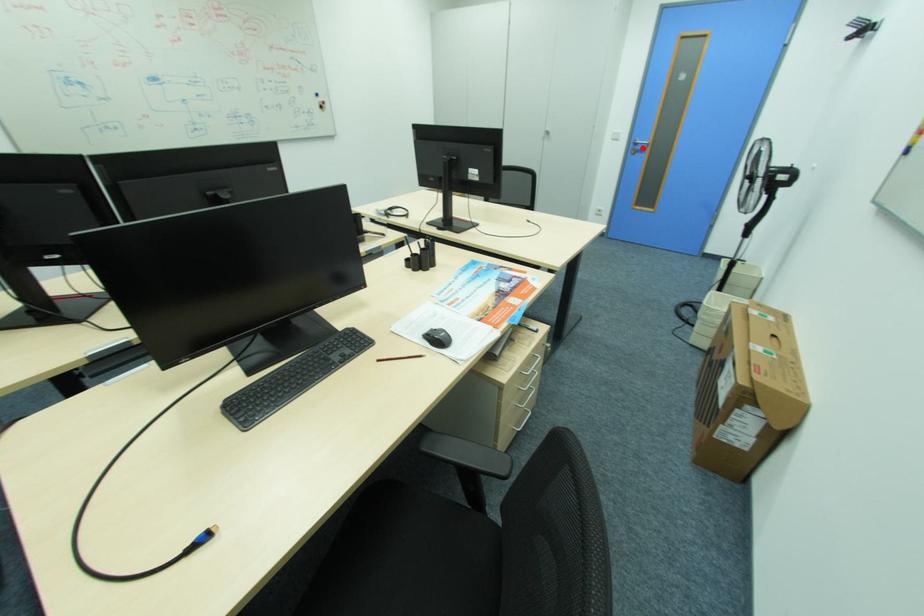
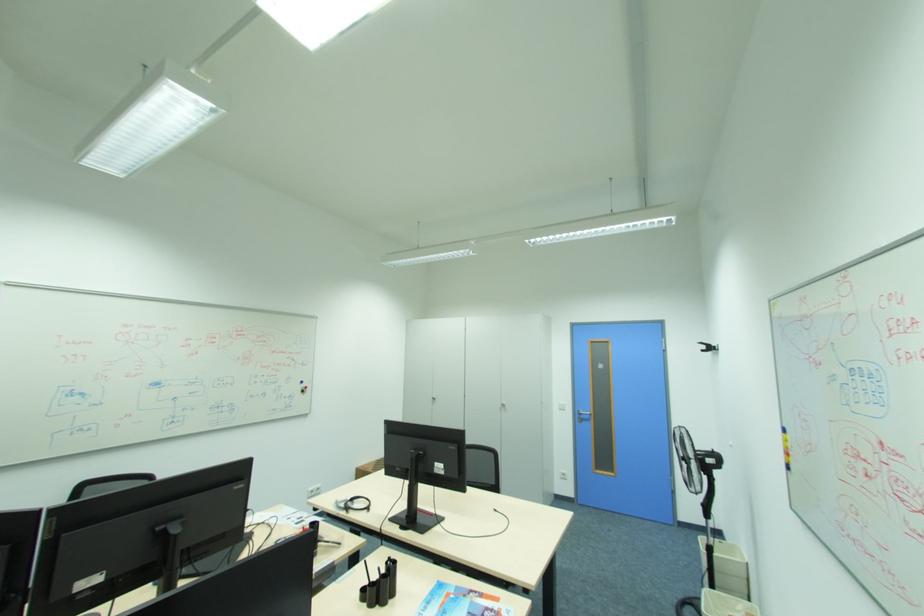
Question: I am providing you with two images of the same scene from different viewpoints. Given a red point in image1, look at the same physical point in image2. Is it:

Choices:
 (A) Closer to the viewpoint
 (B) Farther from the viewpoint

Answer: (B)